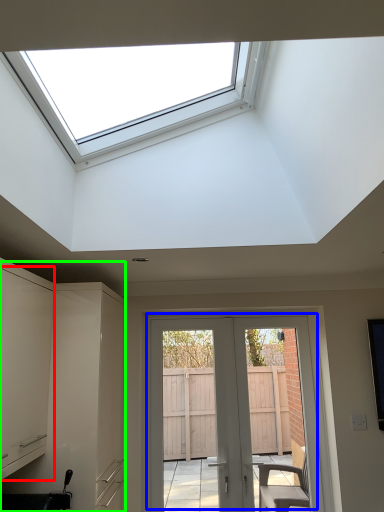
Question: Which object is the closest to the cabinetry (highlighted by a red box)? Choose among these: door (highlighted by a blue box) or cabinetry (highlighted by a green box).

Choices:
 (A) door
 (B) cabinetry

Answer: (B)